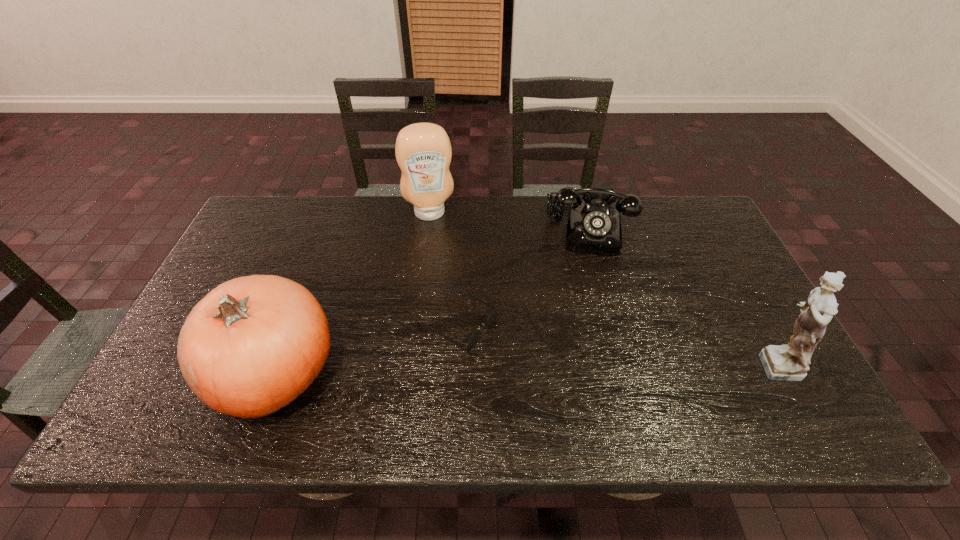
At what (x,y) coordinates should I click in order to perform the action: click on telephone that is at the far edge. Please return your answer as a coordinate pair (x, y). The height and width of the screenshot is (540, 960). Looking at the image, I should click on (594, 227).

Locate an element on the screen. The image size is (960, 540). pumpkin located at the near edge is located at coordinates (251, 346).

The width and height of the screenshot is (960, 540). What are the coordinates of `figurine situated at the near edge` in the screenshot? It's located at (790, 362).

This screenshot has width=960, height=540. I want to click on object that is at the left edge, so click(251, 346).

Identify the location of object present at the right edge. The height and width of the screenshot is (540, 960). (790, 362).

You are a GUI agent. You are given a task and a screenshot of the screen. Output one action in this format:
    pyautogui.click(x=<x>, y=<y>)
    Task: Click on the object situated at the near left corner
    The image size is (960, 540).
    Given the screenshot: What is the action you would take?
    [251, 346]

The height and width of the screenshot is (540, 960). I want to click on object present at the near right corner, so click(790, 362).

The height and width of the screenshot is (540, 960). What are the coordinates of `free space at the far edge of the desktop` in the screenshot? It's located at (324, 200).

Locate an element on the screen. This screenshot has height=540, width=960. vacant space at the near edge of the desktop is located at coordinates (428, 365).

Locate an element on the screen. Image resolution: width=960 pixels, height=540 pixels. vacant space at the left edge is located at coordinates click(x=253, y=255).